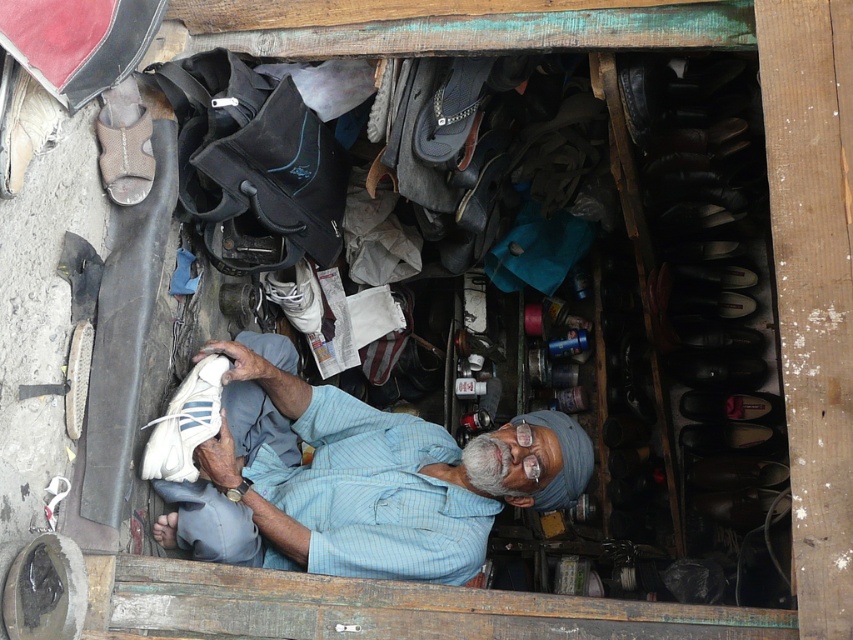
Can you confirm if white fabric shoe at center is bigger than white fabric shoe at lower left?

Yes.

Is white fabric shoe at center thinner than white fabric shoe at lower left?

No, white fabric shoe at center is not thinner than white fabric shoe at lower left.

Identify the location of white fabric shoe at center. (357, 477).